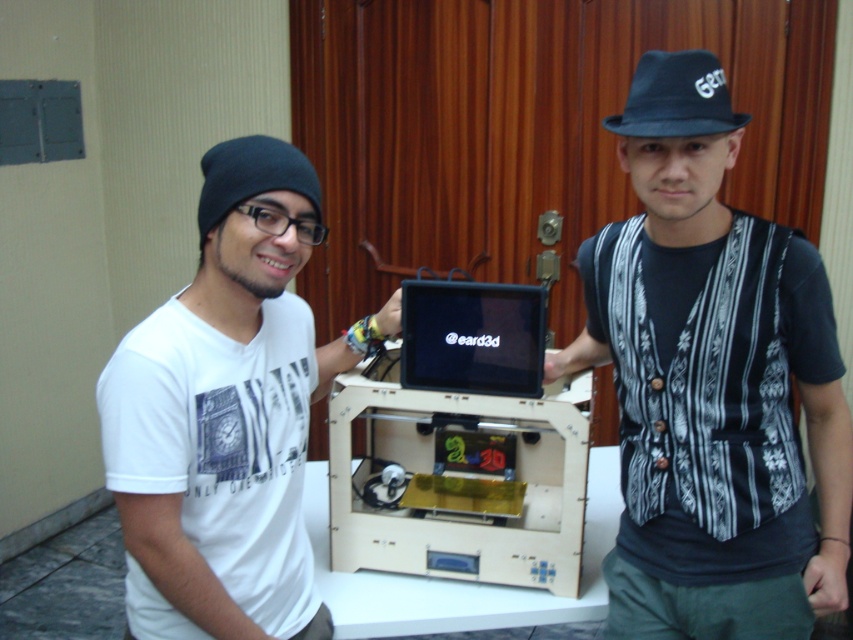
Question: Can you confirm if matte black laptop at center is wider than black fabric baseball hat at upper center?

Choices:
 (A) yes
 (B) no

Answer: (A)

Question: Considering the real-world distances, which object is farthest from the matte black laptop at center?

Choices:
 (A) black fabric baseball hat at upper center
 (B) black knitted hat at upper center

Answer: (A)

Question: In this image, where is black knitted hat at upper center located relative to white matte t-shirt at center?

Choices:
 (A) below
 (B) above

Answer: (B)

Question: Which point is farther from the camera taking this photo?

Choices:
 (A) (762, 291)
 (B) (496, 369)
 (C) (306, 188)

Answer: (B)

Question: Which object is farther from the camera taking this photo?

Choices:
 (A) matte black laptop at center
 (B) black knitted hat at upper center
 (C) white matte t-shirt at center

Answer: (A)

Question: Observing the image, what is the correct spatial positioning of black knitted hat at upper center in reference to white matte t-shirt at center?

Choices:
 (A) right
 (B) left

Answer: (A)